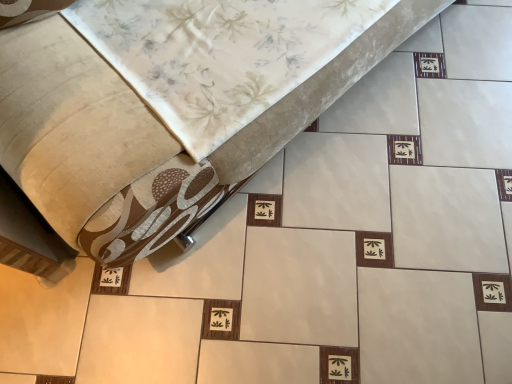
This screenshot has height=384, width=512. What do you see at coordinates (143, 135) in the screenshot?
I see `beige fabric bed at upper left` at bounding box center [143, 135].

The width and height of the screenshot is (512, 384). I want to click on beige fabric bed at upper left, so click(143, 135).

What is the approximate width of beige fabric bed at upper left?

The width of beige fabric bed at upper left is 97.89 centimeters.

Where is `beige fabric bed at upper left`? beige fabric bed at upper left is located at coordinates (143, 135).